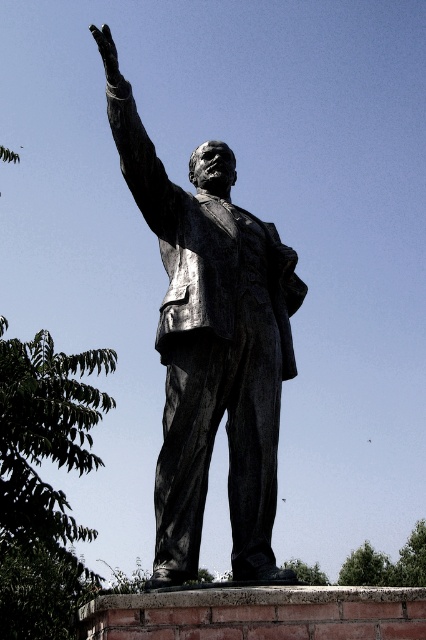
Can you confirm if bronze statue at center is positioned to the right of bronze statue arm at upper left?

Indeed, bronze statue at center is positioned on the right side of bronze statue arm at upper left.

Is bronze statue at center below bronze statue arm at upper left?

Yes, bronze statue at center is below bronze statue arm at upper left.

Which is behind, point (117, 125) or point (150, 140)?

The point (150, 140) is more distant.

I want to click on bronze statue at center, so click(x=210, y=342).